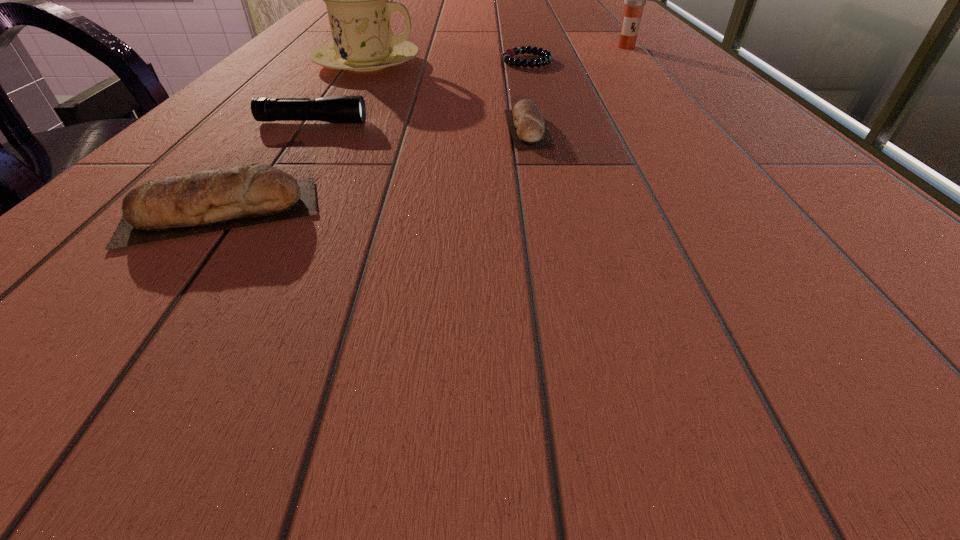
Locate an element on the screen. This screenshot has width=960, height=540. free space that satisfies the following two spatial constraints: 1. on the label side of the medicine; 2. at the lens end of the flashlight is located at coordinates (692, 123).

Image resolution: width=960 pixels, height=540 pixels. I want to click on free space that satisfies the following two spatial constraints: 1. at the lens end of the flashlight; 2. on the front side of the nearer pita bread, so click(251, 213).

Locate an element on the screen. free space that satisfies the following two spatial constraints: 1. on the handle side of the chinaware; 2. on the left side of the right pita bread is located at coordinates (326, 129).

Where is `vacant space that satisfies the following two spatial constraints: 1. at the lens end of the flashlight; 2. on the front side of the fourth shortest object`? Image resolution: width=960 pixels, height=540 pixels. vacant space that satisfies the following two spatial constraints: 1. at the lens end of the flashlight; 2. on the front side of the fourth shortest object is located at coordinates (251, 213).